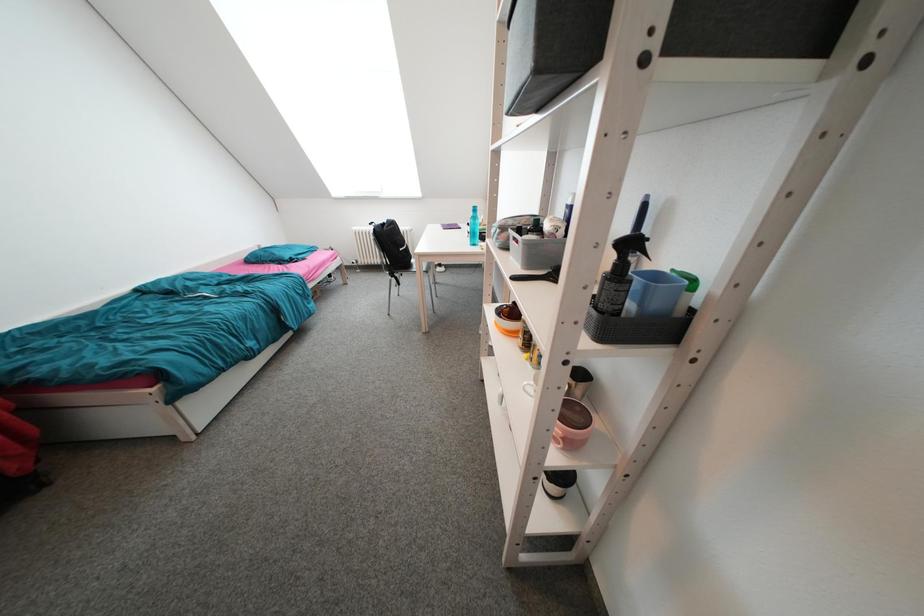
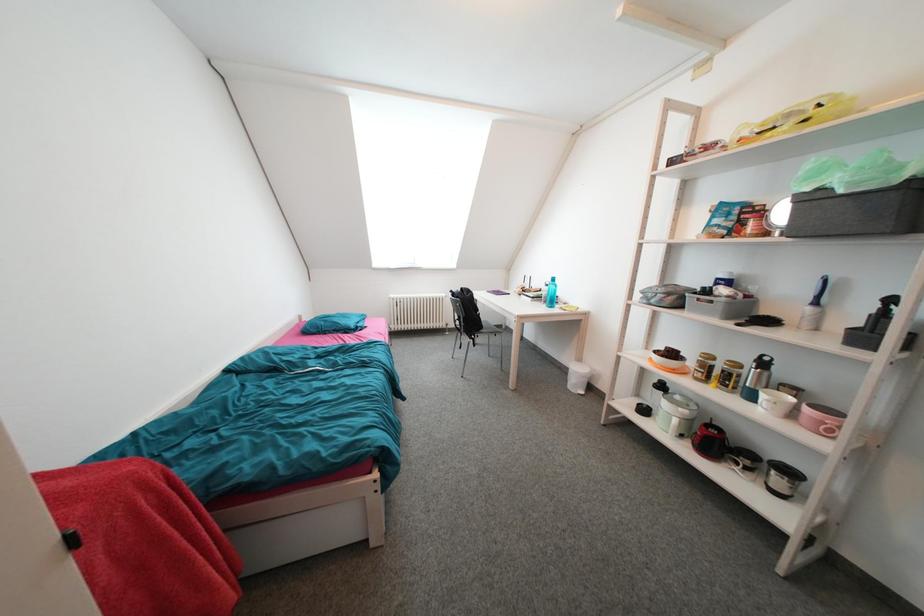
Question: Which direction would the cameraman need to move to produce the second image? Reply with the corresponding letter.

Choices:
 (A) Left
 (B) Right
 (C) Forward
 (D) Backward

Answer: (A)